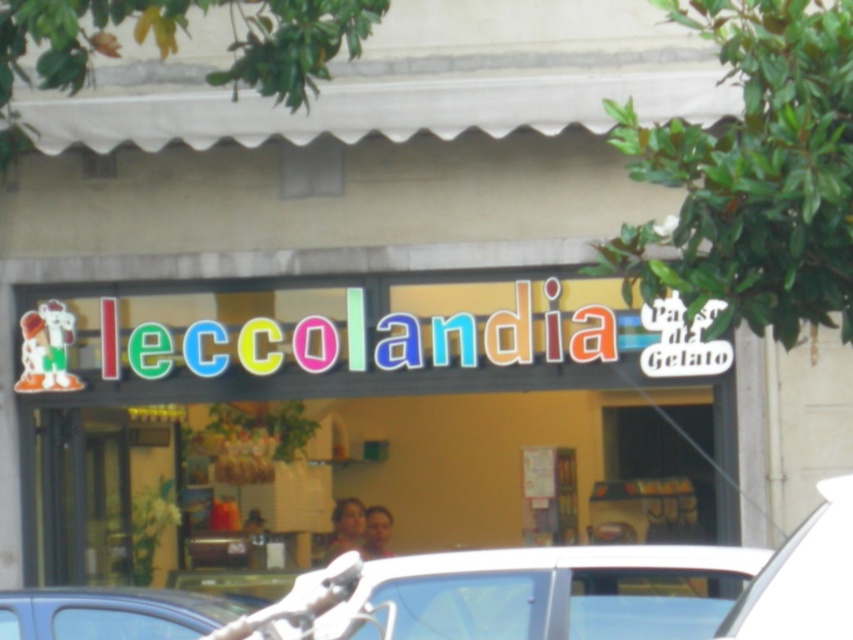
Question: Is white glossy car at lower center positioned in front of white matte car at lower right?

Choices:
 (A) yes
 (B) no

Answer: (B)

Question: Among these points, which one is nearest to the camera?

Choices:
 (A) (700, 586)
 (B) (848, 529)

Answer: (B)

Question: Is white glossy car at lower center to the right of white matte car at lower right from the viewer's perspective?

Choices:
 (A) no
 (B) yes

Answer: (A)

Question: Which point is farther to the camera?

Choices:
 (A) white matte car at lower right
 (B) white glossy car at lower center

Answer: (B)

Question: Which object is closer to the camera taking this photo?

Choices:
 (A) white matte car at lower right
 (B) white glossy car at lower center

Answer: (A)

Question: Is white glossy car at lower center closer to camera compared to white matte car at lower right?

Choices:
 (A) no
 (B) yes

Answer: (A)